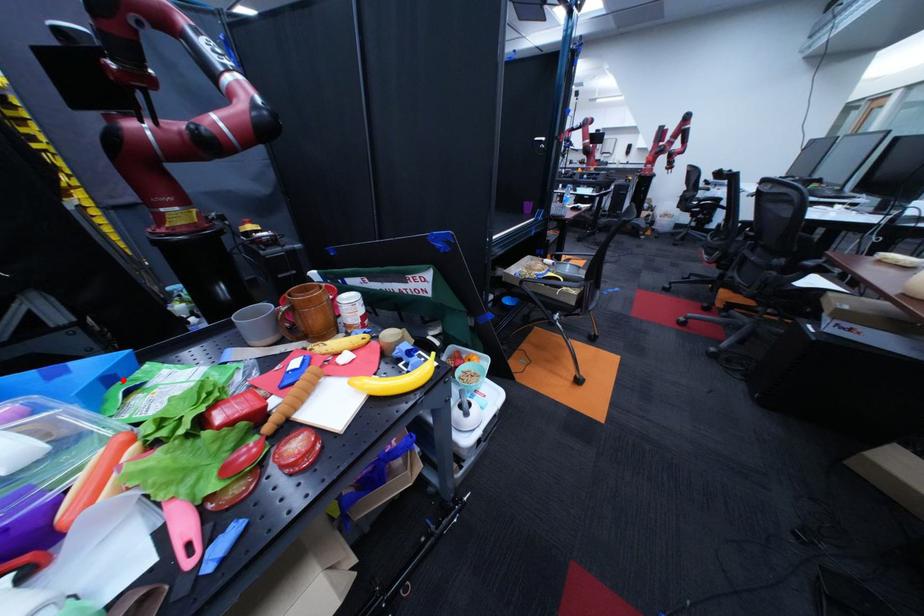
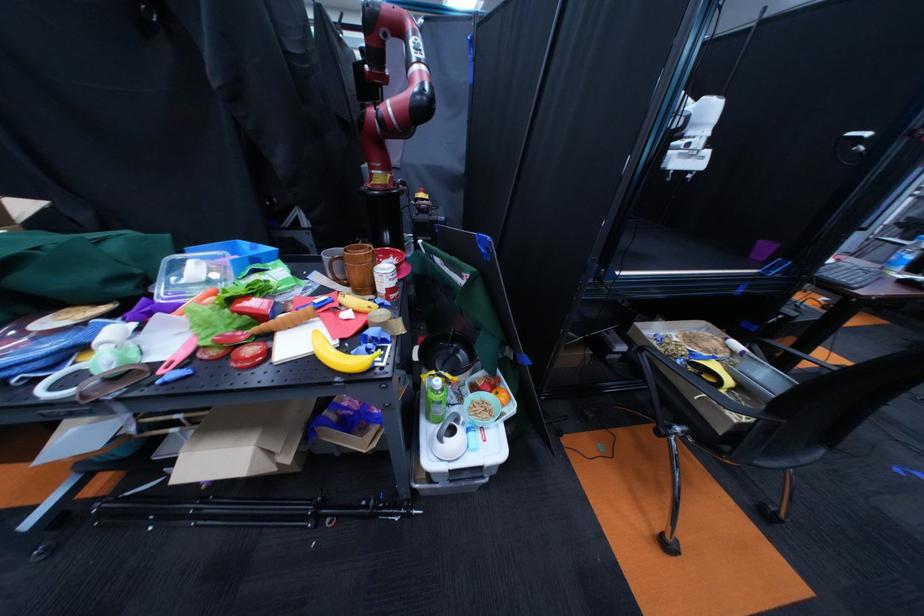
Question: I am providing you with two images of the same scene from different viewpoints. A red point is marked on the first image. Is the red point's position out of view in image 2?

Choices:
 (A) Yes
 (B) No

Answer: (B)